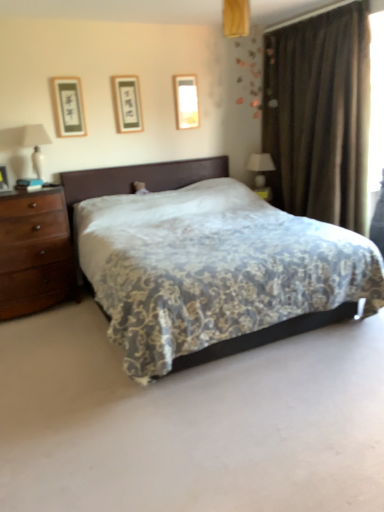
Question: Is point (122, 109) positioned closer to the camera than point (311, 96)?

Choices:
 (A) farther
 (B) closer

Answer: (A)

Question: Looking at their shapes, would you say black paper picture frame at upper center, placed as the 2th picture frame when sorted from left to right, is wider or thinner than brown velvet curtain at right?

Choices:
 (A) thin
 (B) wide

Answer: (A)

Question: Based on their relative distances, which object is nearer to the white glossy table lamp at upper right, which appears as the 2th table lamp when viewed from the front?

Choices:
 (A) floral-patterned fabric bed at center
 (B) matte black picture frame at upper left, acting as the first picture frame starting from the front
 (C) white ceramic table lamp at left, marked as the 2th table lamp in a right-to-left arrangement
 (D) matte glass picture frame at upper center, placed as the 3th picture frame when sorted from front to back
 (E) black paper picture frame at upper center, the 2th picture frame in the front-to-back sequence

Answer: (D)

Question: Which object is the closest to the matte black picture frame at upper left, placed as the first picture frame when sorted from left to right?

Choices:
 (A) black paper picture frame at upper center, placed as the 2th picture frame when sorted from left to right
 (B) floral-patterned fabric bed at center
 (C) matte glass picture frame at upper center, which is the 1th picture frame from back to front
 (D) brown velvet curtain at right
 (E) white ceramic table lamp at left, which ranks as the first table lamp in front-to-back order

Answer: (E)